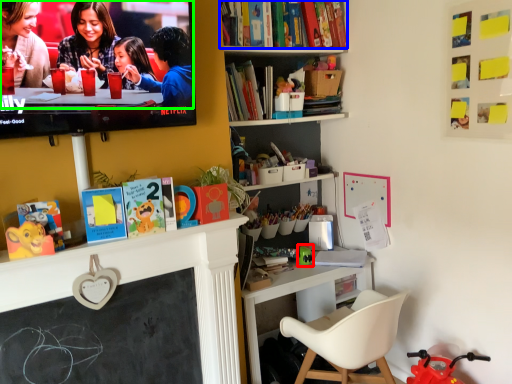
Question: Which object is the closest to the toy (highlighted by a red box)? Choose among these: book (highlighted by a blue box) or couple (highlighted by a green box).

Choices:
 (A) book
 (B) couple

Answer: (A)